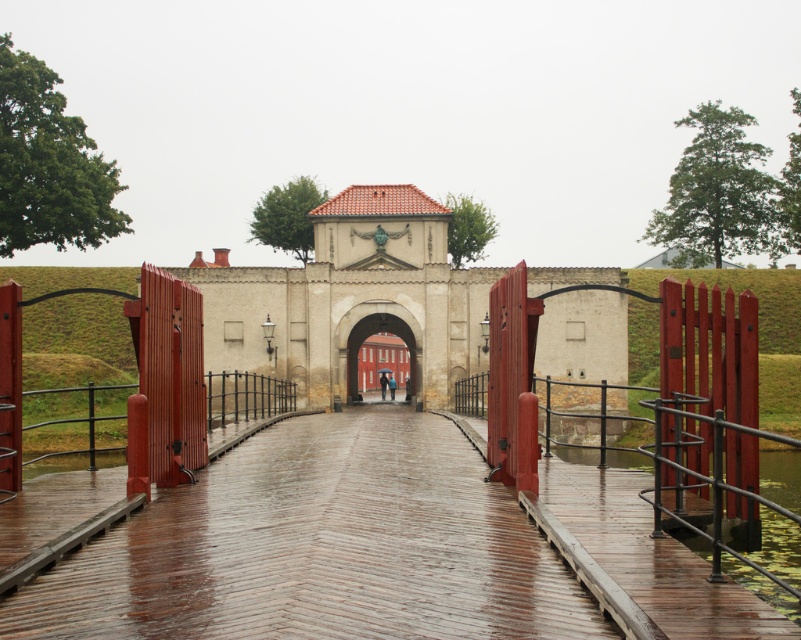
Question: Which point appears farthest from the camera in this image?

Choices:
 (A) (244, 525)
 (B) (375, 320)

Answer: (B)

Question: Is wet wooden bridge at center positioned before red wooden gate at center?

Choices:
 (A) no
 (B) yes

Answer: (B)

Question: Which point is farther from the camera taking this photo?

Choices:
 (A) (376, 620)
 (B) (409, 364)

Answer: (B)

Question: Does wet wooden bridge at center have a smaller size compared to red wooden gate at center?

Choices:
 (A) yes
 (B) no

Answer: (A)

Question: Which point appears closest to the camera in this image?

Choices:
 (A) pyautogui.click(x=413, y=332)
 (B) pyautogui.click(x=325, y=614)

Answer: (B)

Question: Is wet wooden bridge at center thinner than red wooden gate at center?

Choices:
 (A) no
 (B) yes

Answer: (A)